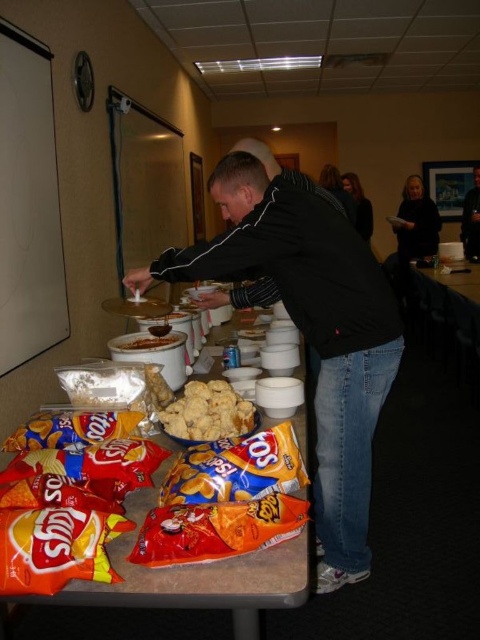
Looking at this image, is matte plastic table at center above matte orange chips at center?

Incorrect, matte plastic table at center is not positioned above matte orange chips at center.

Does point (133, 582) come behind point (237, 477)?

No, (133, 582) is closer to viewer.

Does point (189, 602) come behind point (300, 484)?

No, (189, 602) is closer to viewer.

Image resolution: width=480 pixels, height=640 pixels. In order to click on matte plastic table at center in this screenshot , I will do `click(192, 579)`.

Which is above, black matte jacket at center or golden brown crumbly biscuit at center?

black matte jacket at center is above.

Is black matte jacket at center wider than golden brown crumbly biscuit at center?

Yes, black matte jacket at center is wider than golden brown crumbly biscuit at center.

Describe the element at coordinates (311, 332) in the screenshot. The width and height of the screenshot is (480, 640). I see `black matte jacket at center` at that location.

The height and width of the screenshot is (640, 480). In order to click on black matte jacket at center in this screenshot , I will do `click(311, 332)`.

Can you confirm if black matte jacket at center is taller than black matte jacket at upper center?

Yes.

Does point (357, 272) lie in front of point (358, 195)?

Yes, it is.

At what (x,y) coordinates should I click in order to perform the action: click on black matte jacket at center. Please return your answer as a coordinate pair (x, y). The width and height of the screenshot is (480, 640). Looking at the image, I should click on (311, 332).